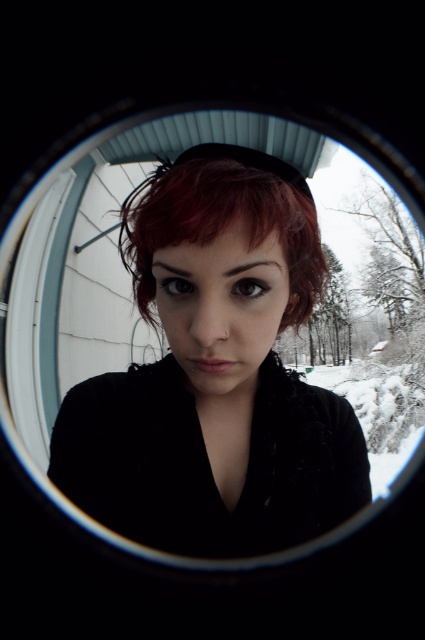
You are taking a photo through a camera lens and notice an object in the frame. The object is located at point 0.583 on the horizontal axis and 0.506 on the vertical axis. Which object from the list below is at that coordinate? Choose from the options provided. The options are matte black hair at center, a snowman in the distance, or a red scarf around the neck.

The object at point (215,372) is the matte black hair at center.